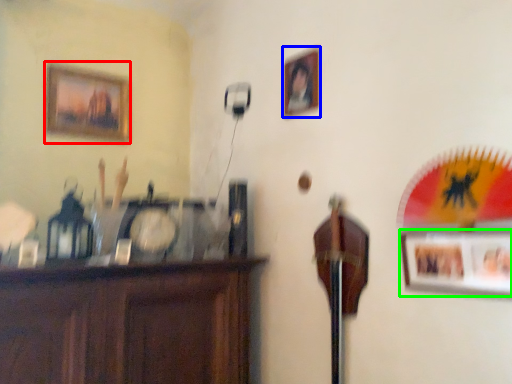
Question: Based on their relative distances, which object is nearer to picture frame (highlighted by a red box)? Choose from picture frame (highlighted by a blue box) and picture frame (highlighted by a green box).

Choices:
 (A) picture frame
 (B) picture frame

Answer: (A)